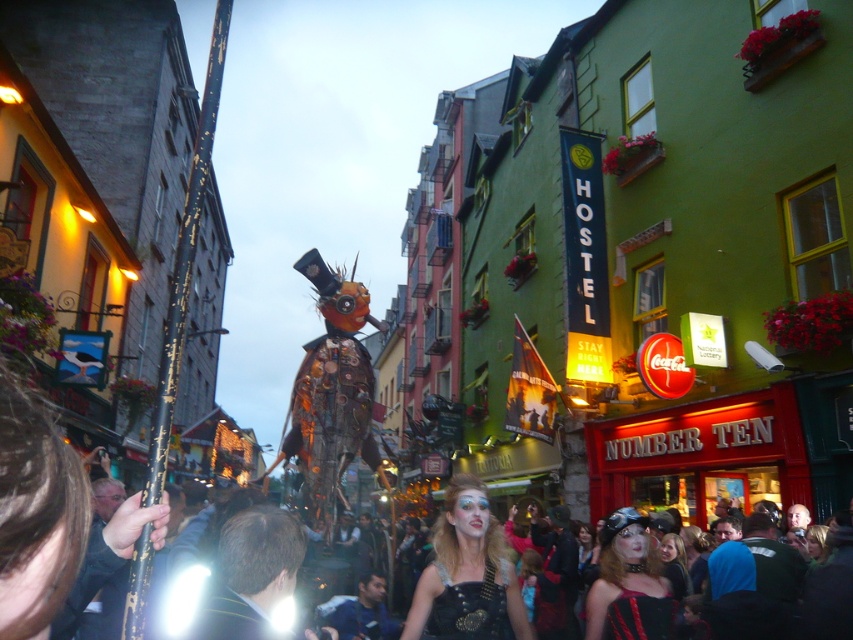
Which is in front, point (488, 568) or point (462, 593)?

Point (462, 593)

Which of these two, shiny black leather dress at center or black leather vest at center, stands taller?

shiny black leather dress at center

The width and height of the screenshot is (853, 640). What do you see at coordinates (466, 573) in the screenshot? I see `shiny black leather dress at center` at bounding box center [466, 573].

Where is `shiny black leather dress at center`? The height and width of the screenshot is (640, 853). shiny black leather dress at center is located at coordinates (466, 573).

Who is more distant from viewer, (605, 576) or (473, 621)?

Positioned behind is point (605, 576).

Is matte black dress at center smaller than black leather vest at center?

Indeed, matte black dress at center has a smaller size compared to black leather vest at center.

Locate an element on the screen. The width and height of the screenshot is (853, 640). matte black dress at center is located at coordinates (628, 582).

Does point (477, 566) come behind point (659, 636)?

Yes, it is behind point (659, 636).

Is shiny black leather dress at center further to camera compared to matte black dress at center?

No, shiny black leather dress at center is in front of matte black dress at center.

What do you see at coordinates (466, 573) in the screenshot? The height and width of the screenshot is (640, 853). I see `shiny black leather dress at center` at bounding box center [466, 573].

Locate an element on the screen. shiny black leather dress at center is located at coordinates (466, 573).